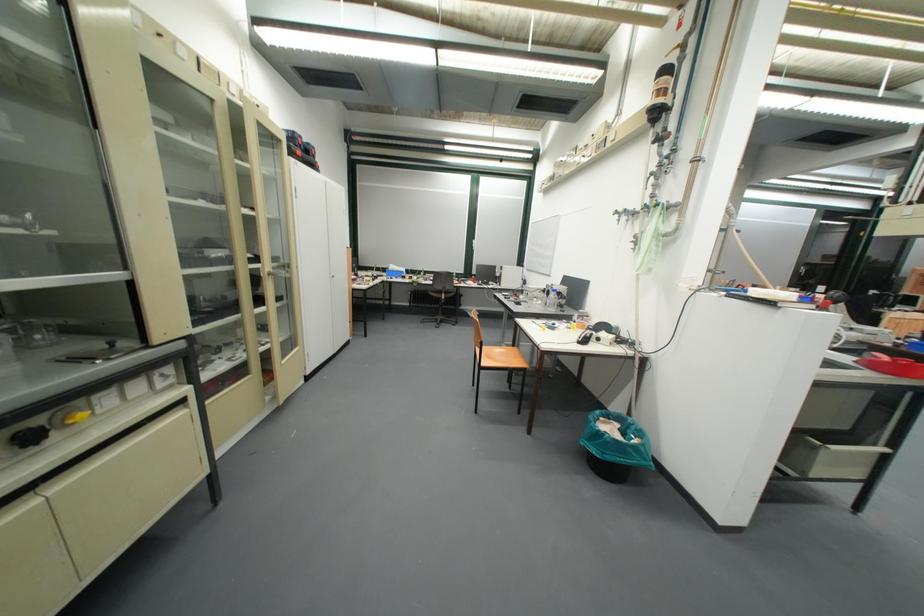
The height and width of the screenshot is (616, 924). What are the coordinates of `black equipment knob` in the screenshot? It's located at (111, 345).